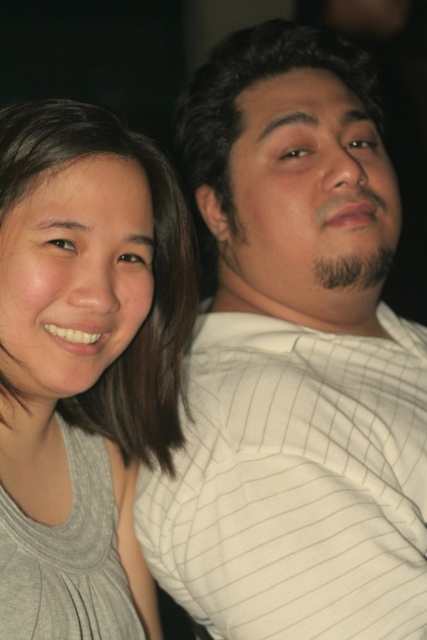
Question: Is the position of white striped shirt at upper right more distant than that of gray matte tank top at left?

Choices:
 (A) yes
 (B) no

Answer: (A)

Question: Can you confirm if white striped shirt at upper right is bigger than gray matte tank top at left?

Choices:
 (A) no
 (B) yes

Answer: (B)

Question: Which of the following is the closest to the observer?

Choices:
 (A) (134, 339)
 (B) (246, 262)

Answer: (A)

Question: In this image, where is white striped shirt at upper right located relative to gray matte tank top at left?

Choices:
 (A) above
 (B) below

Answer: (A)